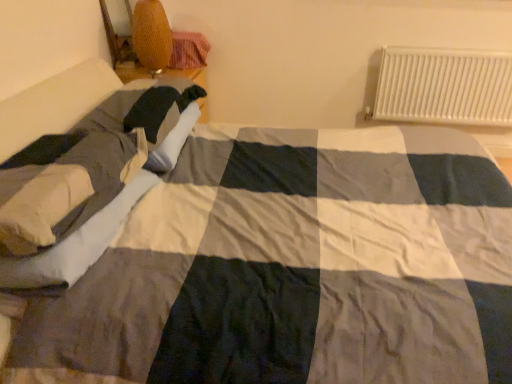
Question: In the image, is woven wicker lampshade at upper left on the left side or the right side of white metal radiator at upper right?

Choices:
 (A) right
 (B) left

Answer: (B)

Question: In terms of size, does woven wicker lampshade at upper left appear bigger or smaller than white metal radiator at upper right?

Choices:
 (A) big
 (B) small

Answer: (B)

Question: Which is nearer to the woven wicker lampshade at upper left?

Choices:
 (A) white metal radiator at upper right
 (B) soft beige pillow at left

Answer: (B)

Question: Which object is the closest to the white metal radiator at upper right?

Choices:
 (A) soft beige pillow at left
 (B) woven wicker lampshade at upper left

Answer: (B)